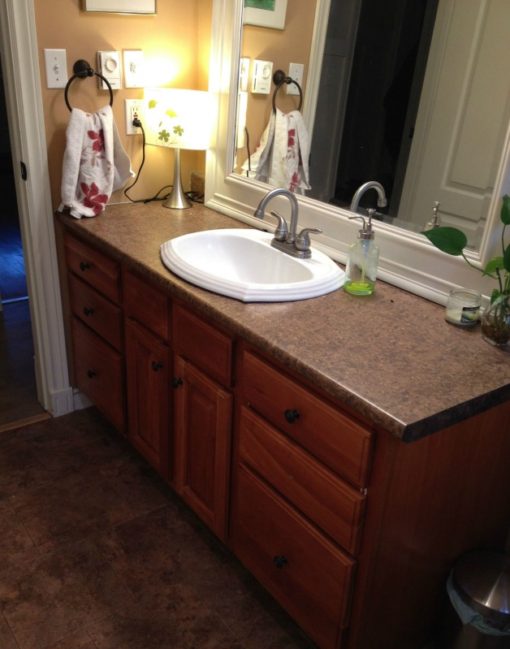
I want to click on countertop, so click(x=372, y=387).